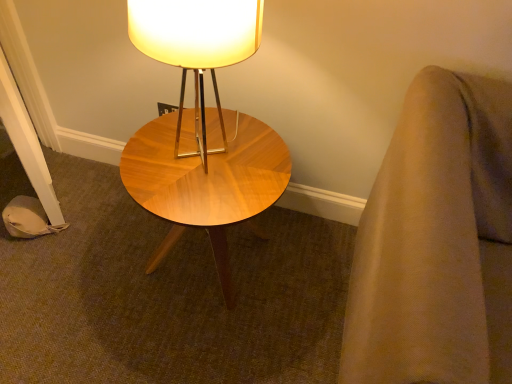
Where is `free space in front of wooden lampshade at center`? free space in front of wooden lampshade at center is located at coordinates (194, 202).